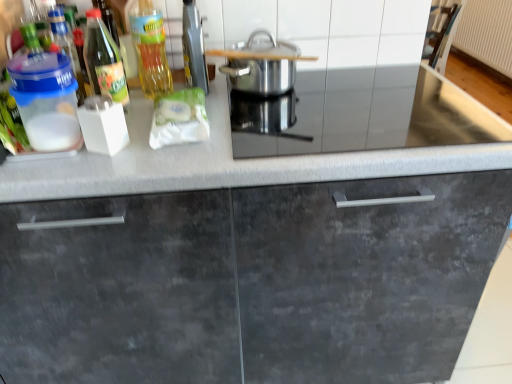
You are a GUI agent. You are given a task and a screenshot of the screen. Output one action in this format:
    pyautogui.click(x=<x>, y=<y>)
    Task: Click on the free location in front of stainless steel pot at center
    The width and height of the screenshot is (512, 384).
    Given the screenshot: What is the action you would take?
    pyautogui.click(x=287, y=119)